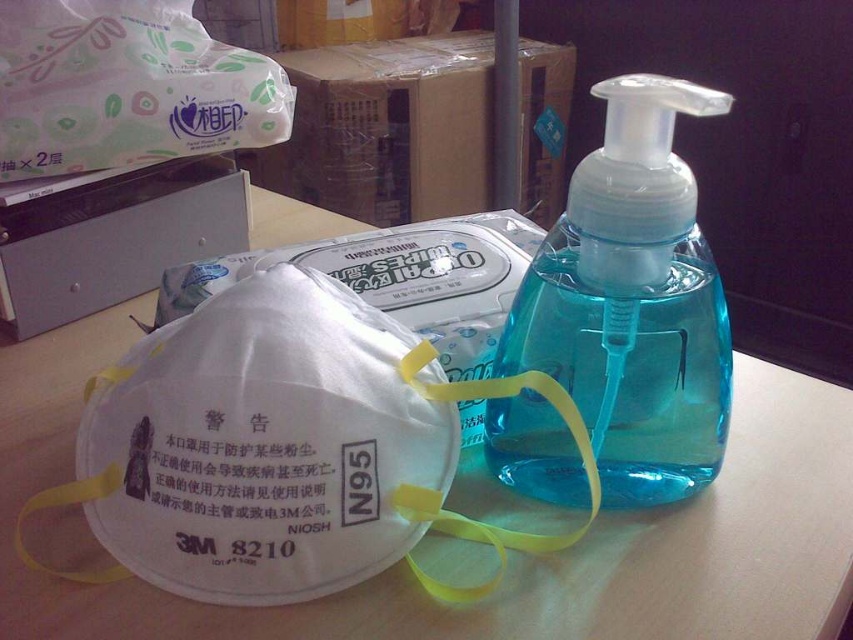
Who is positioned more to the left, white plastic mask at center or blue translucent plastic bottle at center?

From the viewer's perspective, white plastic mask at center appears more on the left side.

Between white plastic mask at center and blue translucent plastic bottle at center, which one is positioned lower?

white plastic mask at center

Measure the distance between white plastic mask at center and camera.

white plastic mask at center is 29.44 centimeters away from camera.

Locate an element on the screen. The height and width of the screenshot is (640, 853). white plastic mask at center is located at coordinates (511, 556).